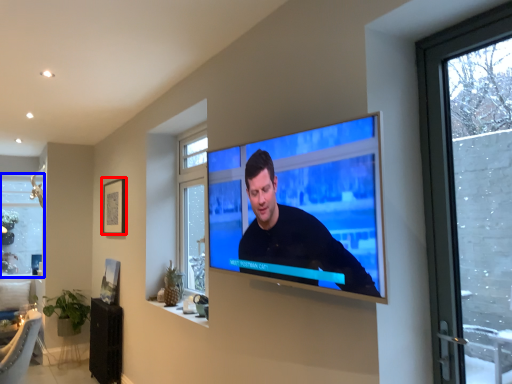
Question: Which object is further to the camera taking this photo, picture frame (highlighted by a red box) or window (highlighted by a blue box)?

Choices:
 (A) picture frame
 (B) window

Answer: (B)